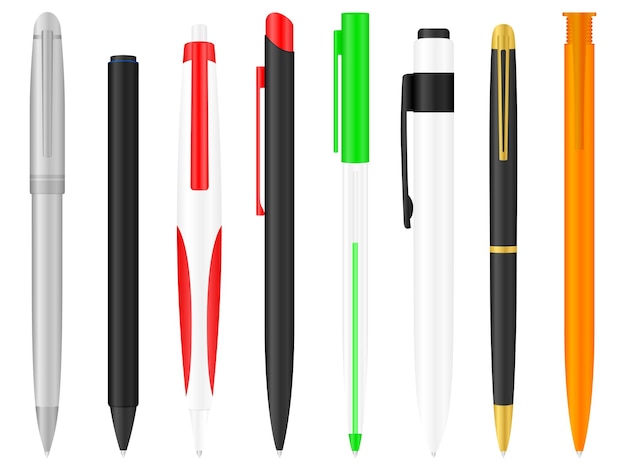
The width and height of the screenshot is (626, 470). I want to click on pens, so click(580, 243), click(500, 244), click(429, 244), click(352, 248), click(280, 258), click(185, 260), click(130, 267), click(48, 267).